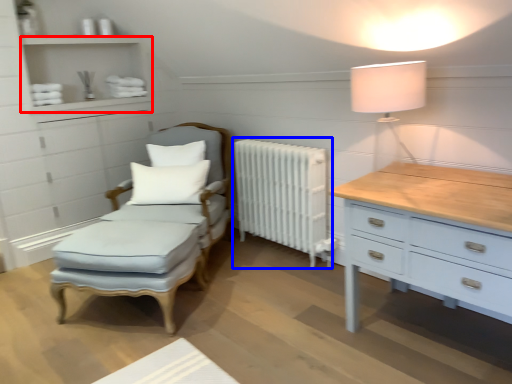
Question: Which object is closer to the camera taking this photo, shelf (highlighted by a red box) or radiator (highlighted by a blue box)?

Choices:
 (A) shelf
 (B) radiator

Answer: (B)